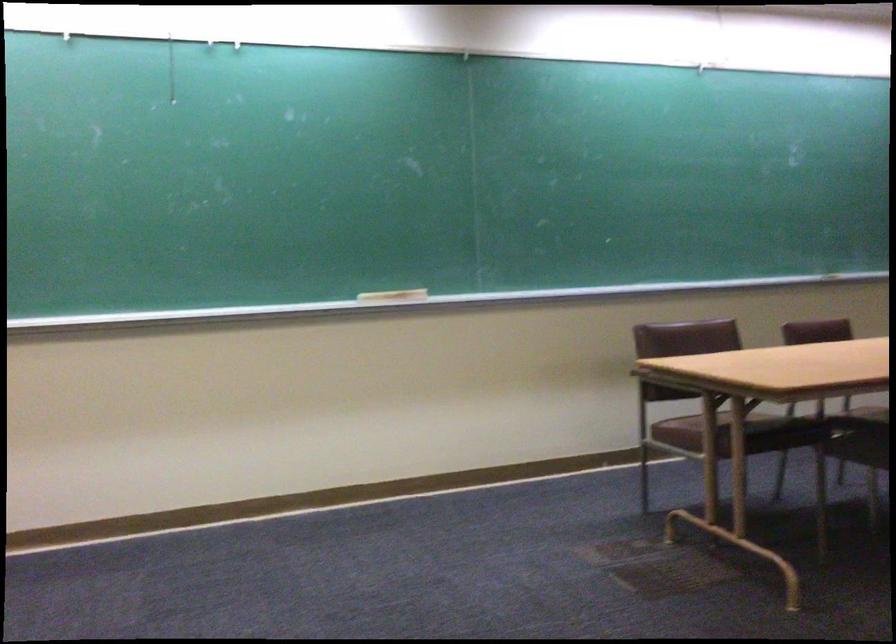
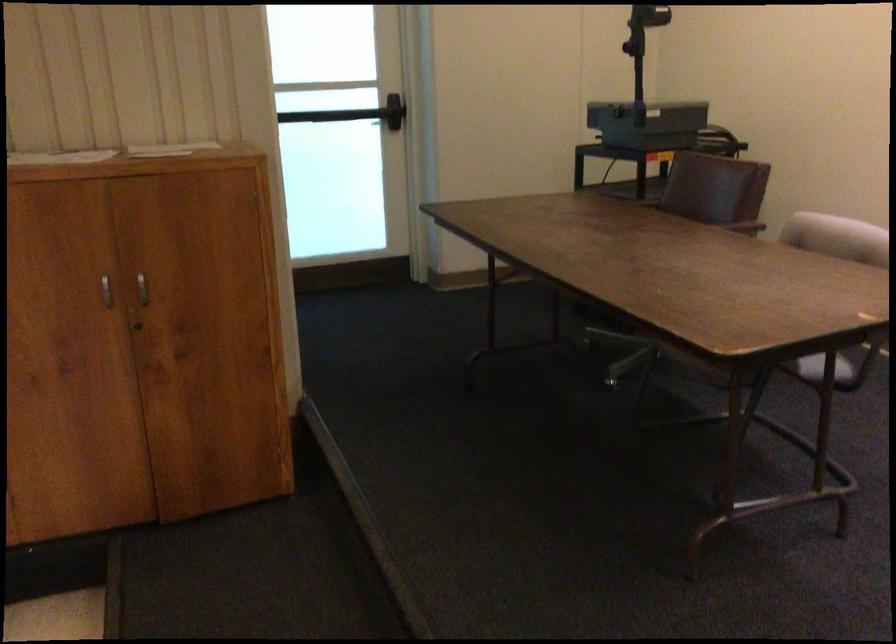
How did the camera likely rotate?

The camera rotated toward left-down.